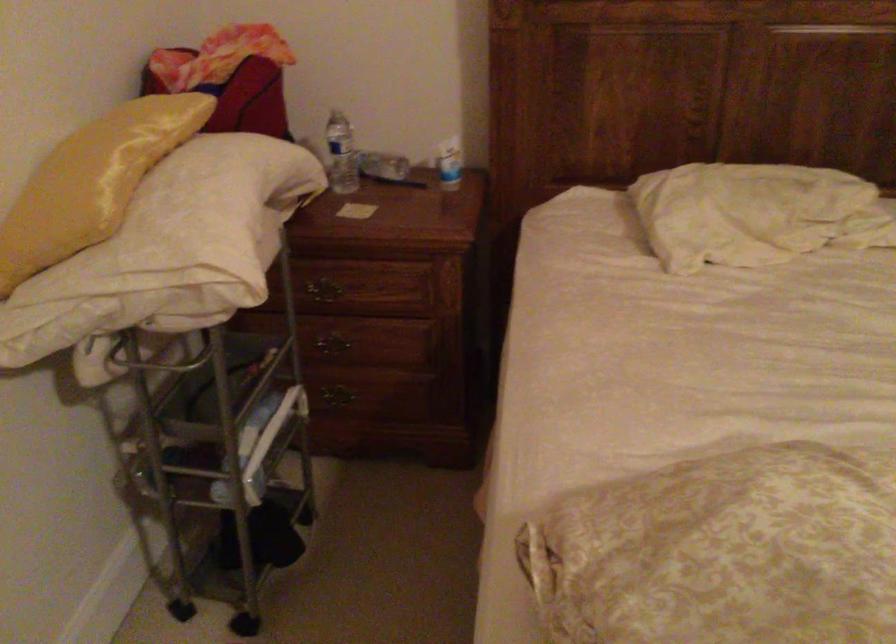
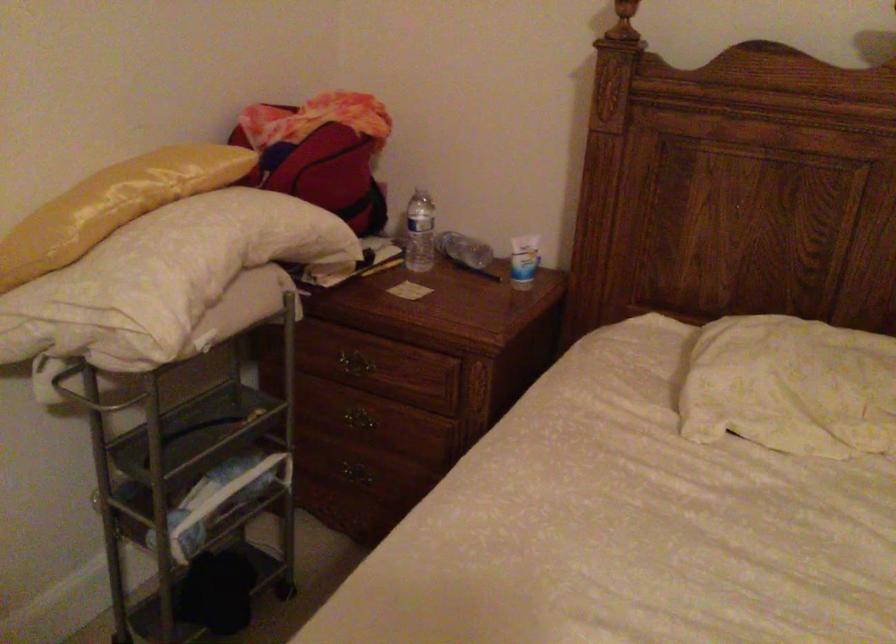
The point at (320, 292) is marked in the first image. Where is the corresponding point in the second image?

(350, 365)